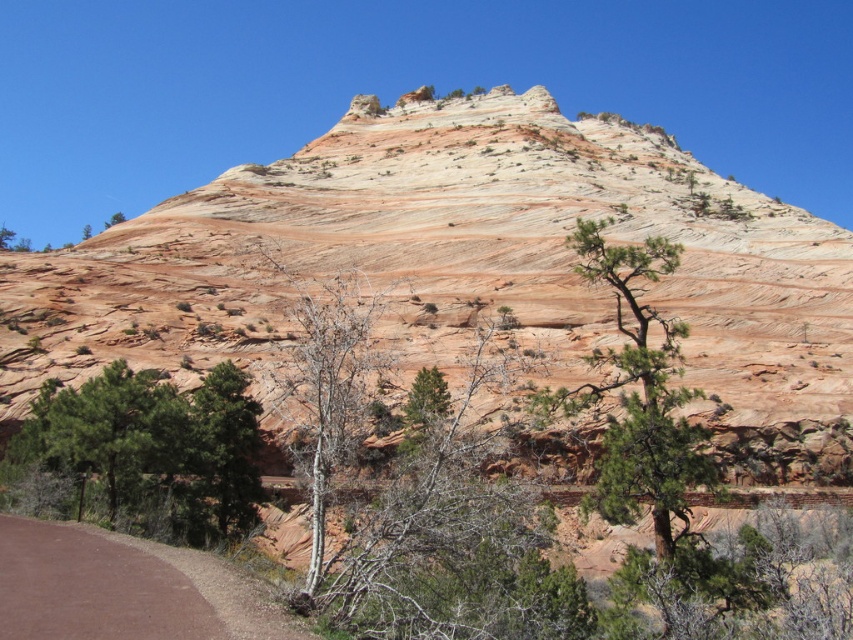
Is green textured tree at center to the right of green leafy tree at lower left from the viewer's perspective?

Correct, you'll find green textured tree at center to the right of green leafy tree at lower left.

Can you confirm if green textured tree at center is thinner than green leafy tree at lower left?

Yes.

The image size is (853, 640). Identify the location of green textured tree at center. (637, 394).

Which is above, green matte tree at lower left or bare wood tree at center?

bare wood tree at center is higher up.

What do you see at coordinates (155, 448) in the screenshot? The width and height of the screenshot is (853, 640). I see `green matte tree at lower left` at bounding box center [155, 448].

In order to click on green matte tree at lower left in this screenshot , I will do `click(155, 448)`.

Who is higher up, green matte tree at lower left or green textured tree at center?

green textured tree at center is above.

Locate an element on the screen. Image resolution: width=853 pixels, height=640 pixels. green matte tree at lower left is located at coordinates (155, 448).

Locate an element on the screen. green matte tree at lower left is located at coordinates (155, 448).